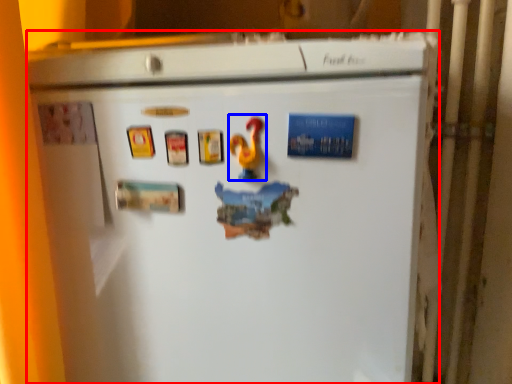
Question: Which point is further to the camera, refrigerator (highlighted by a red box) or toy (highlighted by a blue box)?

Choices:
 (A) refrigerator
 (B) toy

Answer: (B)